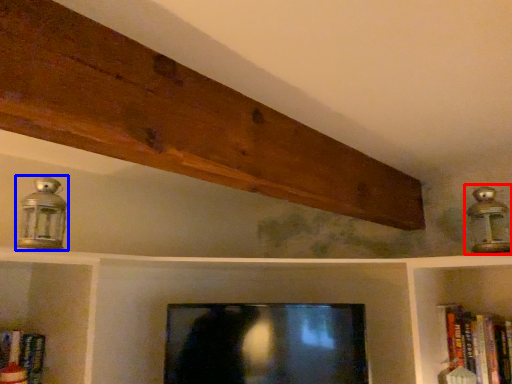
Question: Which object appears closest to the camera in this image, lamp (highlighted by a red box) or lamp (highlighted by a blue box)?

Choices:
 (A) lamp
 (B) lamp

Answer: (B)